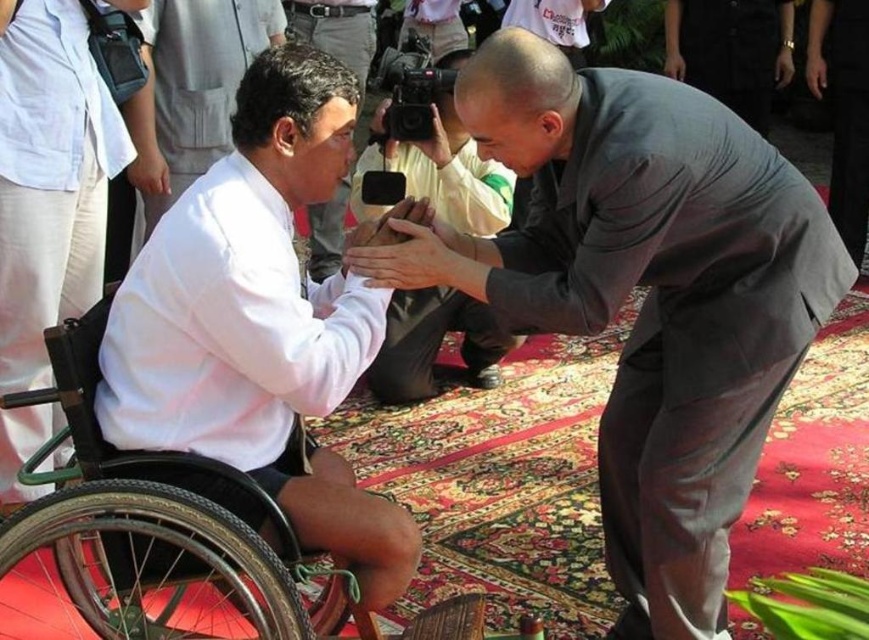
You are a photographer at the event and need to capture a closeup of the black rubber wheelchair at left without the smooth beige handbag at center appearing in the frame. Is this possible given their positions?

The black rubber wheelchair at left is positioned under the smooth beige handbag at center, so adjusting the camera angle downward might allow capturing the wheelchair without the handbag obstructing the view.

You are standing in the scene and want to take a photo of the person in the wheelchair and the monk. The camera you have can focus on objects within 10 feet. Is the point at coordinates point (x=705, y=444) within the camera range?

The distance of point (x=705, y=444) from viewer is 9.07 feet, which is within the camera range of 10 feet. Therefore, the camera can focus on that point.